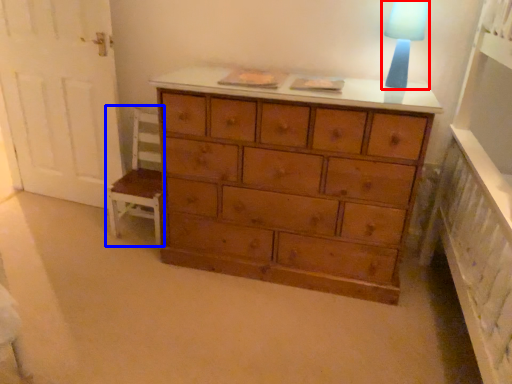
Question: Which point is closer to the camera, lamp (highlighted by a red box) or armchair (highlighted by a blue box)?

Choices:
 (A) lamp
 (B) armchair

Answer: (A)